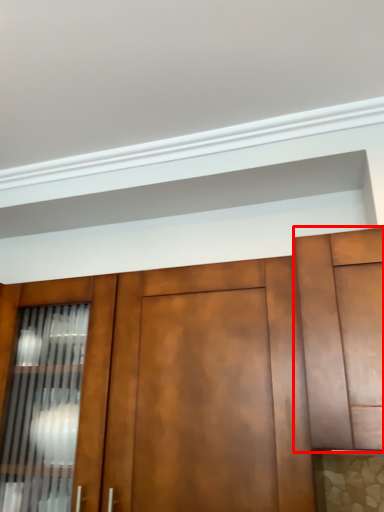
Question: From the image, what is the correct spatial relationship of cabinetry (annotated by the red box) in relation to cabinetry?

Choices:
 (A) right
 (B) left

Answer: (A)